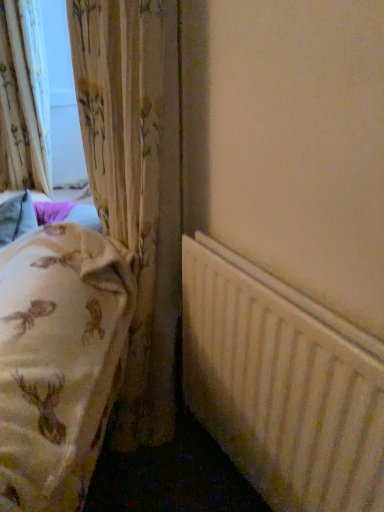
Question: Is floral fabric curtain at left, marked as the 1th curtain in a left-to-right arrangement, bigger or smaller than floral fabric curtain at left, the second curtain viewed from the left?

Choices:
 (A) small
 (B) big

Answer: (B)

Question: Does point (24, 56) appear closer or farther from the camera than point (134, 223)?

Choices:
 (A) closer
 (B) farther

Answer: (B)

Question: Considering the real-world distances, which object is closest to the floral fabric curtain at left, which appears as the 2th curtain when viewed from the right?

Choices:
 (A) white matte radiator at lower right
 (B) floral fabric curtain at left, acting as the first curtain starting from the right

Answer: (B)

Question: Estimate the real-world distances between objects in this image. Which object is closer to the floral fabric curtain at left, acting as the first curtain starting from the right?

Choices:
 (A) floral fabric curtain at left, which appears as the 2th curtain when viewed from the right
 (B) white matte radiator at lower right

Answer: (B)